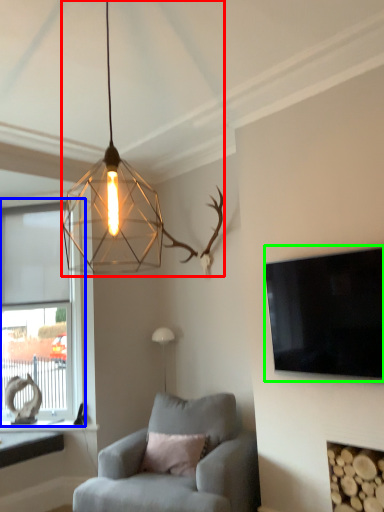
Question: Considering the real-world distances, which object is closest to lamp (highlighted by a red box)? window (highlighted by a blue box) or television (highlighted by a green box).

Choices:
 (A) window
 (B) television

Answer: (B)